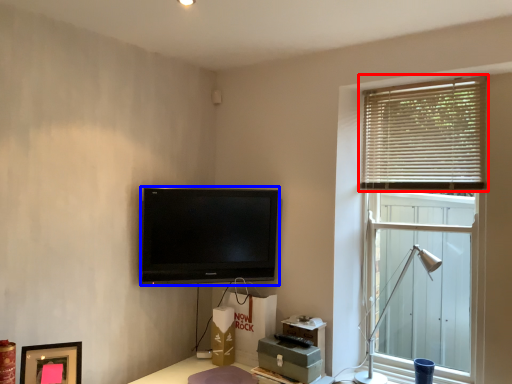
Question: Which of the following is the closest to the observer, window blind (highlighted by a red box) or television (highlighted by a blue box)?

Choices:
 (A) window blind
 (B) television

Answer: (A)